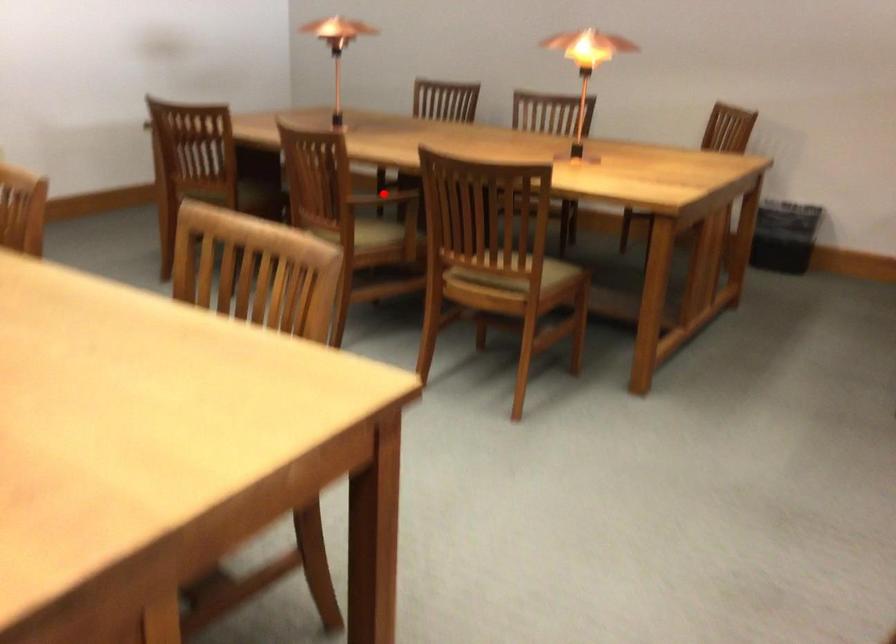
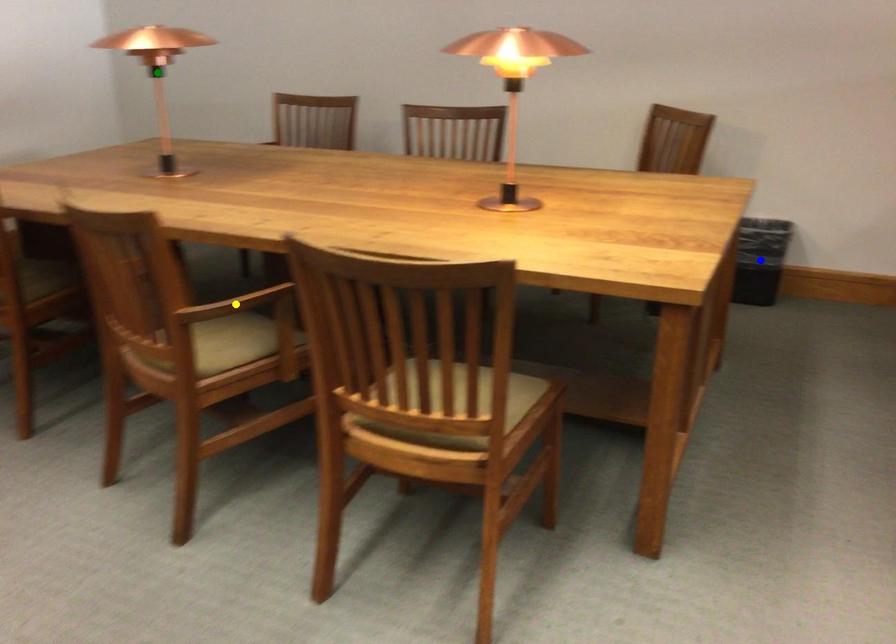
Question: I am providing you with two images of the same scene from different viewpoints. A red point is marked on the first image. You are given multiple points on the second image. In image 2, which mark is for the same physical point as the one in image 1?

Choices:
 (A) blue point
 (B) yellow point
 (C) green point

Answer: (B)